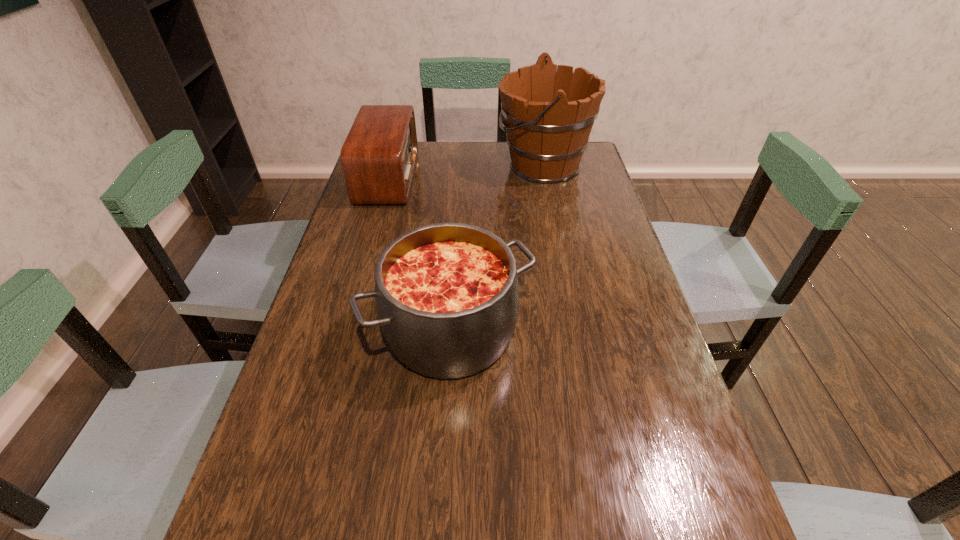
The width and height of the screenshot is (960, 540). Identify the location of free space between the tallest object and the radio receiver. (466, 171).

The height and width of the screenshot is (540, 960). I want to click on vacant space that is in between the radio receiver and the tallest object, so click(466, 171).

The width and height of the screenshot is (960, 540). Find the location of `object that is the second closest one to the casserole`. object that is the second closest one to the casserole is located at coordinates (549, 115).

Find the location of a particular element. the closest object relative to the wine bucket is located at coordinates (378, 158).

This screenshot has width=960, height=540. In order to click on blank space that satisfies the following two spatial constraints: 1. on the front panel of the radio receiver; 2. on the left side of the nearest object in this screenshot , I will do `click(345, 331)`.

This screenshot has height=540, width=960. Find the location of `free space that satisfies the following two spatial constraints: 1. on the back side of the nearest object; 2. on the front panel of the radio receiver`. free space that satisfies the following two spatial constraints: 1. on the back side of the nearest object; 2. on the front panel of the radio receiver is located at coordinates (460, 178).

At what (x,y) coordinates should I click in order to perform the action: click on vacant space that satisfies the following two spatial constraints: 1. on the front panel of the nearest object; 2. on the right side of the radio receiver. Please return your answer as a coordinate pair (x, y). Looking at the image, I should click on (345, 331).

Where is `free location that satisfies the following two spatial constraints: 1. on the front panel of the casserole; 2. on the right side of the radio receiver`? free location that satisfies the following two spatial constraints: 1. on the front panel of the casserole; 2. on the right side of the radio receiver is located at coordinates (345, 331).

Where is `vacant space that satisfies the following two spatial constraints: 1. on the front panel of the radio receiver; 2. on the left side of the nearest object`? vacant space that satisfies the following two spatial constraints: 1. on the front panel of the radio receiver; 2. on the left side of the nearest object is located at coordinates (345, 331).

You are a GUI agent. You are given a task and a screenshot of the screen. Output one action in this format:
    pyautogui.click(x=<x>, y=<y>)
    Task: Click on the vacant space that satisfies the following two spatial constraints: 1. on the back side of the nearest object; 2. on the front panel of the radio receiver
    This screenshot has width=960, height=540.
    Given the screenshot: What is the action you would take?
    pyautogui.click(x=460, y=178)